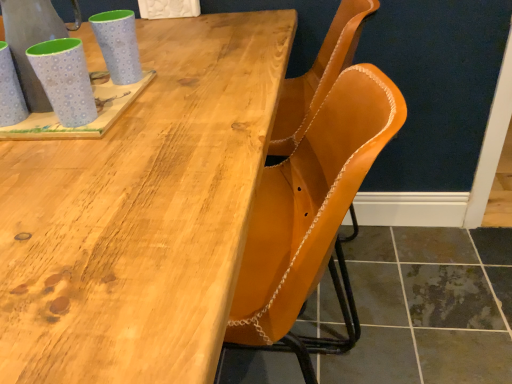
Question: Is matte blue mug at upper left, the 2th mug positioned from the right, smaller than leather at center?

Choices:
 (A) no
 (B) yes

Answer: (B)

Question: Is the surface of matte blue mug at upper left, marked as the second mug in a left-to-right arrangement, in direct contact with leather at center?

Choices:
 (A) no
 (B) yes

Answer: (A)

Question: From the image's perspective, is matte blue mug at upper left, the 2th mug positioned from the right, on top of leather at center?

Choices:
 (A) no
 (B) yes

Answer: (B)

Question: Can you confirm if matte blue mug at upper left, the 2th mug positioned from the right, is positioned to the right of leather at center?

Choices:
 (A) no
 (B) yes

Answer: (A)

Question: Is matte blue mug at upper left, the 2th mug positioned from the right, behind leather at center?

Choices:
 (A) no
 (B) yes

Answer: (A)

Question: In the image, is matte blue mug at upper left, the 2th mug positioned from the right, positioned in front of or behind matte blue mug at upper left, which is the 3th mug in left-to-right order?

Choices:
 (A) front
 (B) behind

Answer: (A)

Question: Considering the positions of point (81, 97) and point (126, 48), is point (81, 97) closer or farther from the camera than point (126, 48)?

Choices:
 (A) closer
 (B) farther

Answer: (A)

Question: In terms of height, does matte blue mug at upper left, marked as the second mug in a left-to-right arrangement, look taller or shorter compared to matte blue mug at upper left, which is the 3th mug in left-to-right order?

Choices:
 (A) tall
 (B) short

Answer: (A)

Question: Is matte blue mug at upper left, marked as the second mug in a left-to-right arrangement, spatially inside matte blue mug at upper left, which ranks as the 1th mug in right-to-left order, or outside of it?

Choices:
 (A) outside
 (B) inside

Answer: (A)

Question: In terms of height, does matte blue mug at upper left, which is the 3th mug in left-to-right order, look taller or shorter compared to matte blue mug at left, acting as the third mug starting from the right?

Choices:
 (A) short
 (B) tall

Answer: (A)

Question: From the image's perspective, is matte blue mug at upper left, which is the 3th mug in left-to-right order, above or below matte blue mug at left, acting as the third mug starting from the right?

Choices:
 (A) below
 (B) above

Answer: (B)

Question: In terms of size, does matte blue mug at upper left, which ranks as the 1th mug in right-to-left order, appear bigger or smaller than matte blue mug at left, acting as the 1th mug starting from the left?

Choices:
 (A) small
 (B) big

Answer: (A)

Question: Considering their positions, is matte blue mug at upper left, which is the 3th mug in left-to-right order, located in front of or behind matte blue mug at left, acting as the 1th mug starting from the left?

Choices:
 (A) behind
 (B) front

Answer: (A)

Question: Would you say leather at center is to the left or to the right of matte blue mug at upper left, the 2th mug positioned from the right, in the picture?

Choices:
 (A) right
 (B) left

Answer: (A)

Question: From the image's perspective, is leather at center positioned above or below matte blue mug at upper left, the 2th mug positioned from the right?

Choices:
 (A) above
 (B) below

Answer: (B)